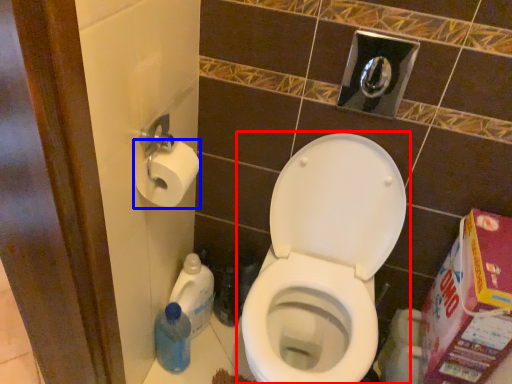
Question: Which object appears closest to the camera in this image, toilet (highlighted by a red box) or toilet paper (highlighted by a blue box)?

Choices:
 (A) toilet
 (B) toilet paper

Answer: (A)